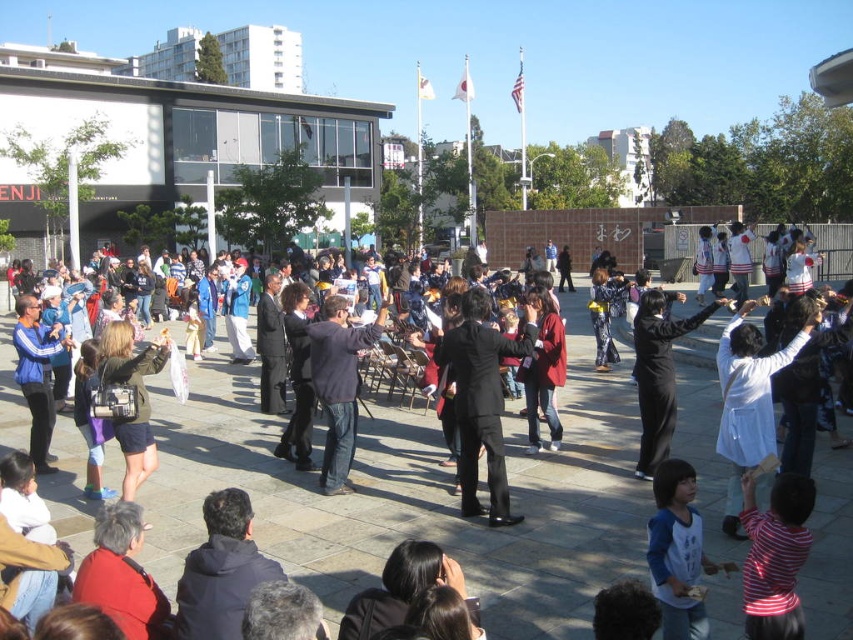
You are a photographer standing at the edge of the crowd. You want to capture a photo that includes both the matte black suit at center and the green matte jacket at lower left. What is the minimum distance you need to move backward to ensure both subjects are in frame?

The minimum distance you need to move backward to include both the matte black suit at center and the green matte jacket at lower left is determined by the distance between them, which is 4.76 meters. To ensure both are in frame, you should position yourself far enough back so that your camera can capture a wide enough angle to encompass the 4.76 meter gap between the two subjects.

You are a photographer standing at the edge of the crowd, trying to capture both the matte black suit at center and the black smooth suit at center in your shot. Which performer should you adjust your camera focus on first to ensure clarity?

The matte black suit at center is closer to the viewer than the black smooth suit at center, so you should focus on the matte black suit at center first to ensure it is in clear focus before adjusting for the other performer.